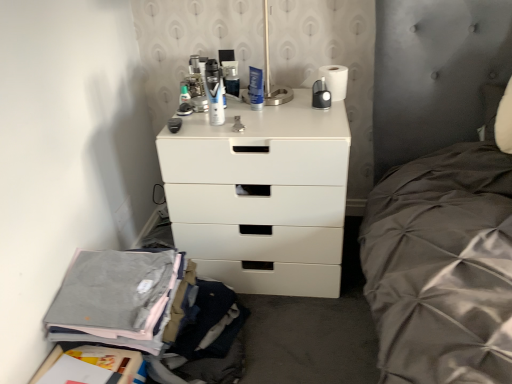
Identify the location of free point to the right of matte black shaving cream can at center, the second toiletry in the left-to-right sequence. (267, 121).